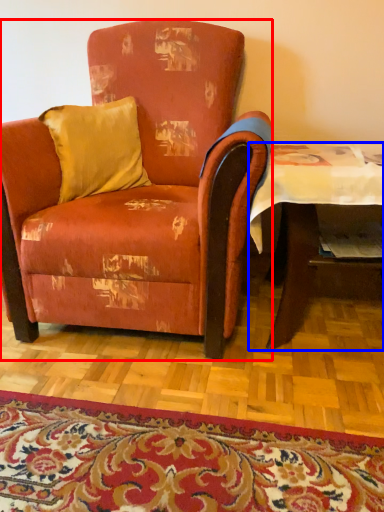
Question: Which object appears closest to the camera in this image, chair (highlighted by a red box) or table (highlighted by a blue box)?

Choices:
 (A) chair
 (B) table

Answer: (A)